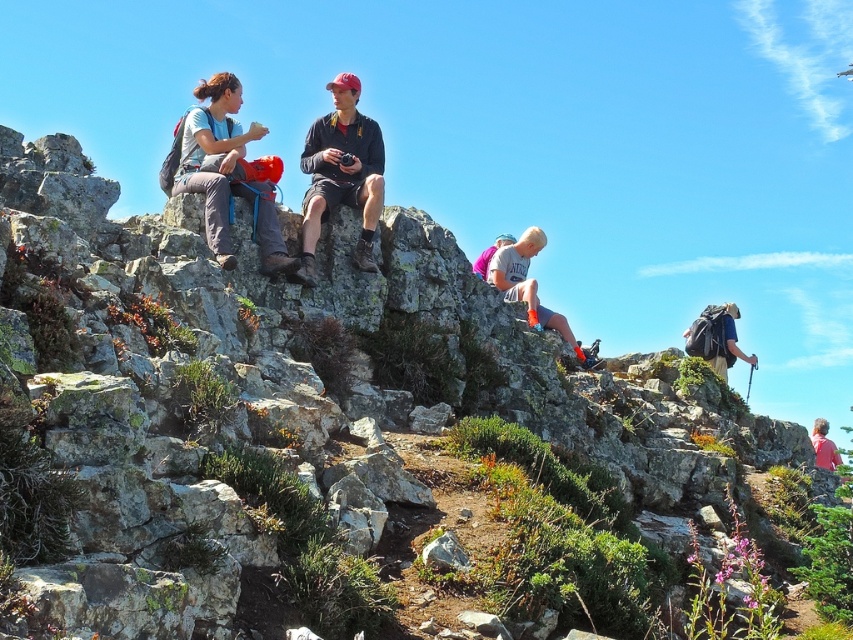
Is blonde hair at center smaller than matte black backpack at right?

No.

Is blonde hair at center in front of matte black backpack at right?

Yes, it is in front of matte black backpack at right.

Identify the location of blonde hair at center. The image size is (853, 640). (531, 288).

The height and width of the screenshot is (640, 853). Identify the location of blonde hair at center. (531, 288).

Can you confirm if matte black jacket at center is shorter than pink fabric shirt at lower right?

Indeed, matte black jacket at center has a lesser height compared to pink fabric shirt at lower right.

Is matte black jacket at center wider than pink fabric shirt at lower right?

Incorrect, matte black jacket at center's width does not surpass pink fabric shirt at lower right's.

Does point (338, 163) come closer to viewer compared to point (813, 445)?

Yes.

The width and height of the screenshot is (853, 640). Find the location of `matte black jacket at center`. matte black jacket at center is located at coordinates (341, 173).

Is blonde hair at center wider than pink fabric shirt at lower right?

In fact, blonde hair at center might be narrower than pink fabric shirt at lower right.

Can you confirm if blonde hair at center is bigger than pink fabric shirt at lower right?

No.

The image size is (853, 640). What are the coordinates of `blonde hair at center` in the screenshot? It's located at (531, 288).